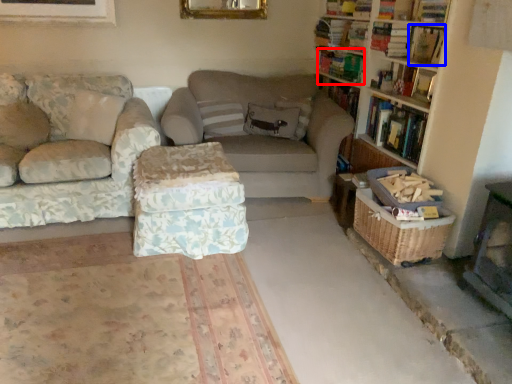
Question: Among these objects, which one is nearest to the camera, book (highlighted by a red box) or book (highlighted by a blue box)?

Choices:
 (A) book
 (B) book

Answer: (B)